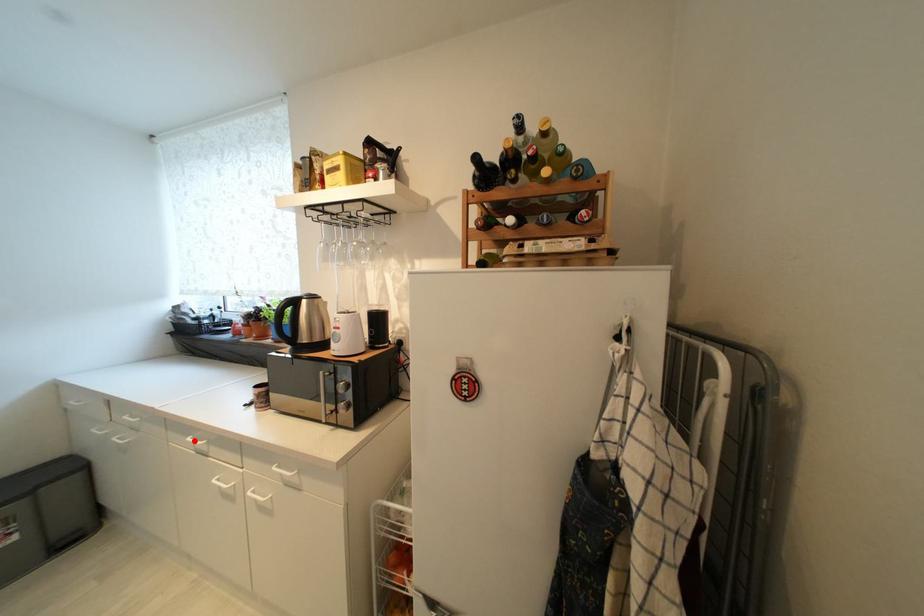
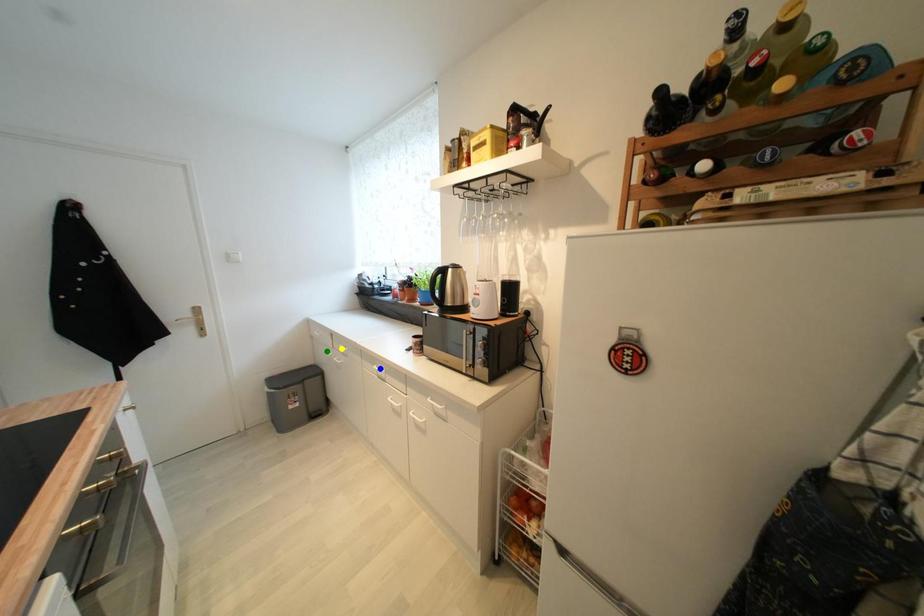
Question: I am providing you with two images of the same scene from different viewpoints. A red point is marked on the first image. You are given multiple points on the second image. In image 2, which mark is for the same physical point as the one in image 1?

Choices:
 (A) yellow point
 (B) green point
 (C) blue point

Answer: (C)